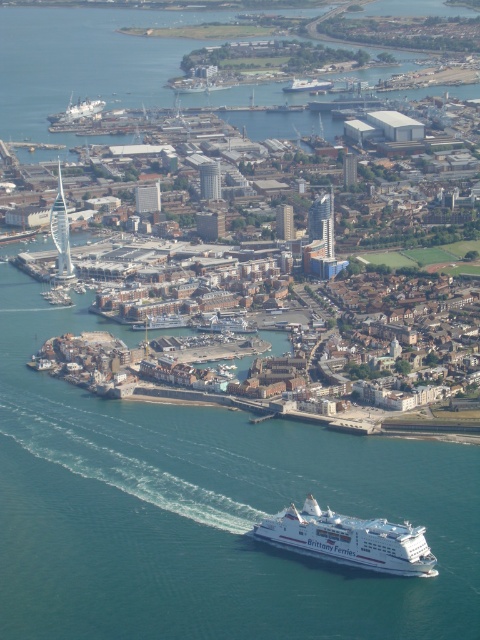
In the scene shown: Who is more forward, (345,525) or (324,90)?

Point (345,525) is in front.

Where is `white matte ferry at lower center`? This screenshot has width=480, height=640. white matte ferry at lower center is located at coordinates (349, 540).